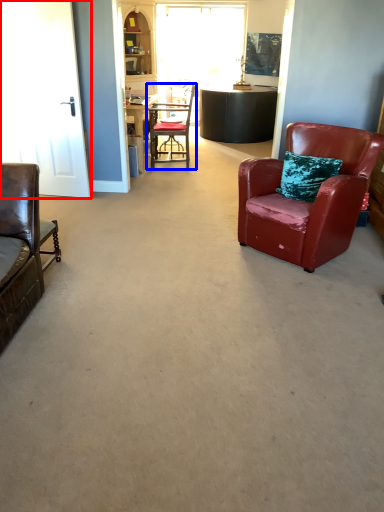
Question: Which of the following is the farthest to the observer, glass door (highlighted by a red box) or chair (highlighted by a blue box)?

Choices:
 (A) glass door
 (B) chair

Answer: (B)